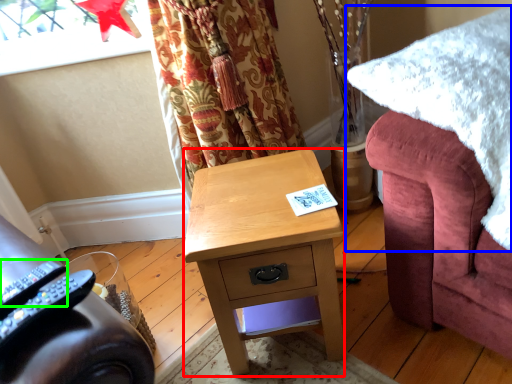
Question: Estimate the real-world distances between objects in this image. Which object is closer to desk (highlighted by a red box), blanket (highlighted by a blue box) or remote control (highlighted by a green box)?

Choices:
 (A) blanket
 (B) remote control

Answer: (A)